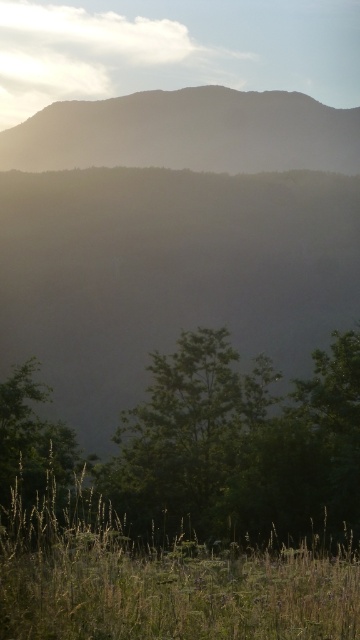
Question: Is dark brown mountain at upper center wider than green leafy tree at lower left?

Choices:
 (A) yes
 (B) no

Answer: (A)

Question: Which point is closer to the camera?

Choices:
 (A) green leafy tree at center
 (B) dark brown mountain at upper center

Answer: (A)

Question: Can you confirm if green leafy tree at center is smaller than green leafy tree at lower left?

Choices:
 (A) no
 (B) yes

Answer: (A)

Question: Among these objects, which one is nearest to the camera?

Choices:
 (A) green leafy tree at center
 (B) dark brown mountain at upper center

Answer: (A)

Question: Is the position of silhouetted mountain at upper center less distant than that of dark brown mountain at upper center?

Choices:
 (A) no
 (B) yes

Answer: (B)

Question: Which object is positioned closest to the green grassy at lower center?

Choices:
 (A) green leafy tree at lower left
 (B) silhouetted mountain at upper center
 (C) green leafy tree at center

Answer: (A)